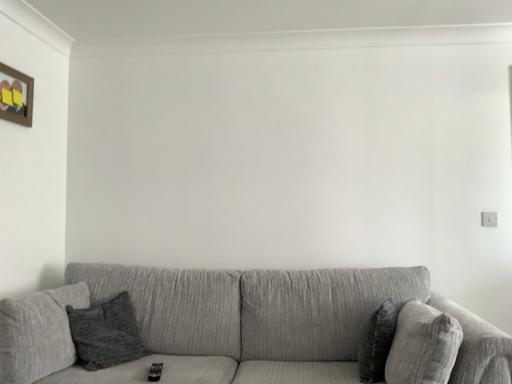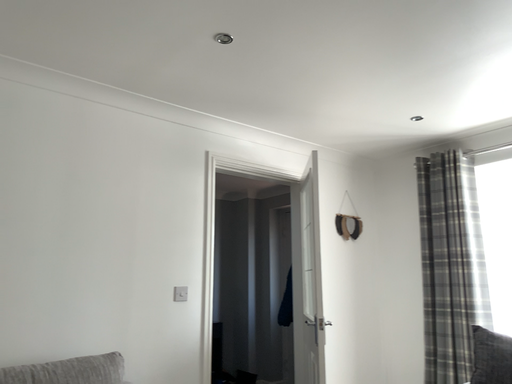
Question: Which way did the camera rotate in the video?

Choices:
 (A) rotated left
 (B) rotated right

Answer: (B)